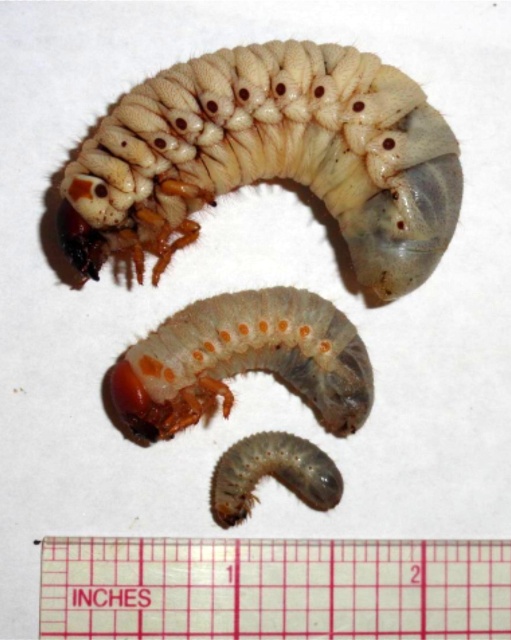
Question: Is translucent white caterpillar at upper center in front of translucent rubber caterpillar at lower center?

Choices:
 (A) no
 (B) yes

Answer: (B)

Question: Is transparent plastic ruler at lower center wider than translucent gelatinous caterpillar at center?

Choices:
 (A) yes
 (B) no

Answer: (A)

Question: Is transparent plastic ruler at lower center below translucent gelatinous caterpillar at center?

Choices:
 (A) yes
 (B) no

Answer: (A)

Question: Estimate the real-world distances between objects in this image. Which object is closer to the translucent white caterpillar at upper center?

Choices:
 (A) translucent gelatinous caterpillar at center
 (B) translucent rubber caterpillar at lower center
 (C) transparent plastic ruler at lower center

Answer: (A)

Question: Which point is farther to the camera?

Choices:
 (A) (262, 604)
 (B) (147, 413)
 (C) (108, 152)
 (D) (243, 486)

Answer: (D)

Question: Among these objects, which one is nearest to the camera?

Choices:
 (A) translucent gelatinous caterpillar at center
 (B) translucent white caterpillar at upper center

Answer: (B)